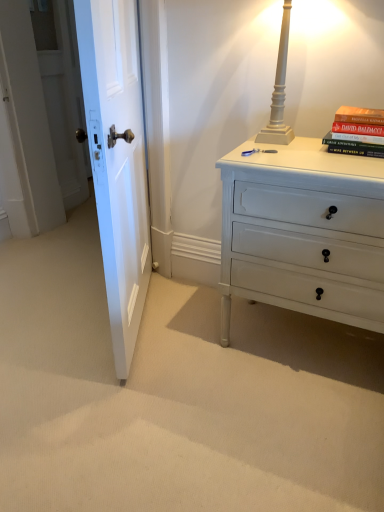
Where is `free space in front of white painted wood table lamp at upper right`? free space in front of white painted wood table lamp at upper right is located at coordinates click(313, 159).